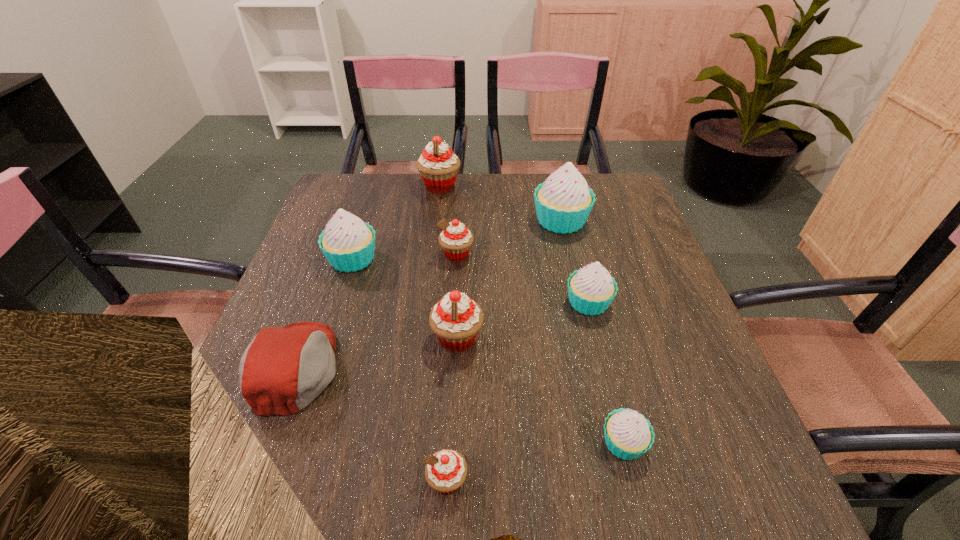
Image resolution: width=960 pixels, height=540 pixels. In order to click on object that can be found as the fifth closest to the red cap in this screenshot , I will do `click(591, 289)`.

This screenshot has height=540, width=960. I want to click on object that ranks as the fourth closest to the second smallest pink cupcake, so click(x=591, y=289).

Choose which cupcake is the fourth nearest neighbor to the third farthest white cupcake. Please provide its 2D coordinates. Your answer should be formatted as a tuple, i.e. [(x, y)], where the tuple contains the x and y coordinates of a point satisfying the conditions above.

[(628, 434)]

Point out which cupcake is positioned as the second nearest to the second nearest white cupcake. Please provide its 2D coordinates. Your answer should be formatted as a tuple, i.e. [(x, y)], where the tuple contains the x and y coordinates of a point satisfying the conditions above.

[(456, 320)]

Identify which pink cupcake is the second nearest to the second biggest pink cupcake. Please provide its 2D coordinates. Your answer should be formatted as a tuple, i.e. [(x, y)], where the tuple contains the x and y coordinates of a point satisfying the conditions above.

[(446, 470)]

Select which pink cupcake appears as the second closest to the second farthest cupcake. Please provide its 2D coordinates. Your answer should be formatted as a tuple, i.e. [(x, y)], where the tuple contains the x and y coordinates of a point satisfying the conditions above.

[(438, 165)]

Identify the location of white cupcake that is the fourth closest to the third farthest pink cupcake. The image size is (960, 540). (563, 202).

The image size is (960, 540). Find the location of `white cupcake that is the second closest to the third biggest pink cupcake`. white cupcake that is the second closest to the third biggest pink cupcake is located at coordinates (563, 202).

The width and height of the screenshot is (960, 540). In order to click on vacant area in the image that satisfies the following two spatial constraints: 1. on the front-facing side of the cap; 2. on the right side of the smallest pink cupcake in this screenshot , I will do `click(255, 481)`.

The width and height of the screenshot is (960, 540). I want to click on vacant space that satisfies the following two spatial constraints: 1. on the back side of the smallest pink cupcake; 2. on the left side of the third smallest pink cupcake, so click(455, 339).